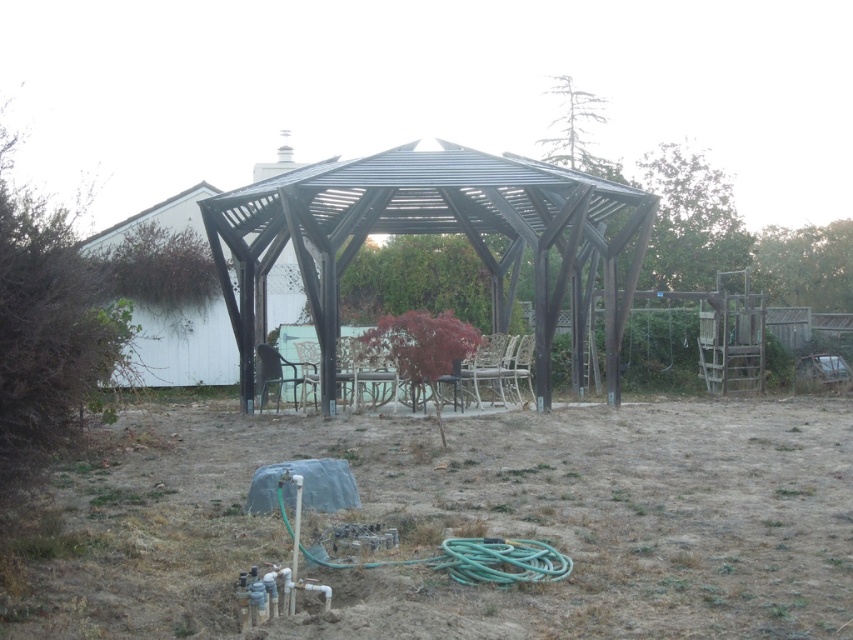
Question: Can you confirm if metallic black gazebo at center is wider than matte black pergola at left?

Choices:
 (A) no
 (B) yes

Answer: (B)

Question: Can you confirm if brown dry soil at center is wider than metallic gray chair at center?

Choices:
 (A) yes
 (B) no

Answer: (A)

Question: Among these points, which one is nearest to the camera?

Choices:
 (A) (503, 561)
 (B) (485, 358)
 (C) (262, 355)
 (D) (838, 586)

Answer: (D)

Question: Can you confirm if brown dry soil at center is bigger than metallic black gazebo at center?

Choices:
 (A) no
 (B) yes

Answer: (A)

Question: Which point is closer to the camera?

Choices:
 (A) green rubber garden hose at lower center
 (B) metallic gray chair at center
 (C) brown dry soil at center
 (D) matte black pergola at left

Answer: (C)

Question: Which of the following is the closest to the observer?

Choices:
 (A) (486, 340)
 (B) (550, 628)

Answer: (B)